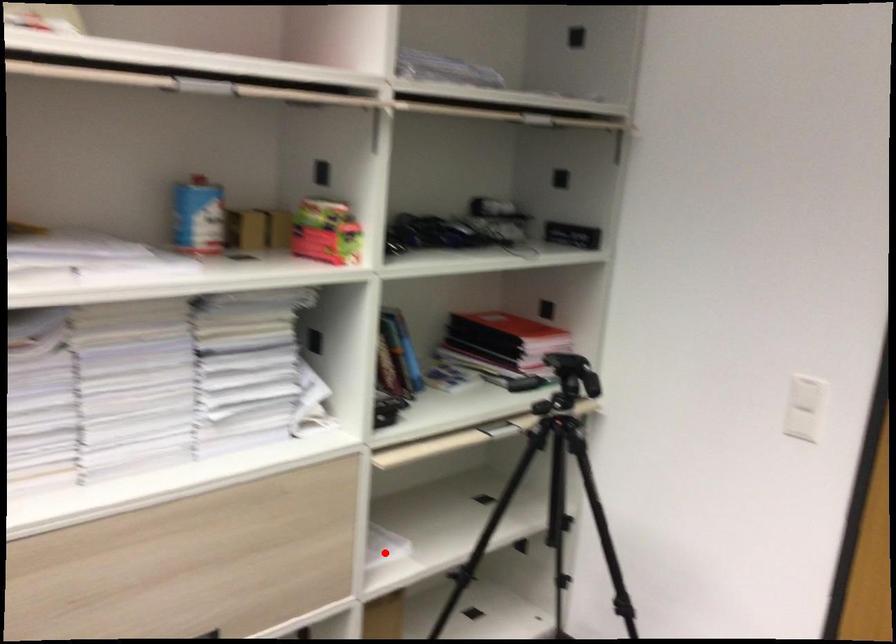
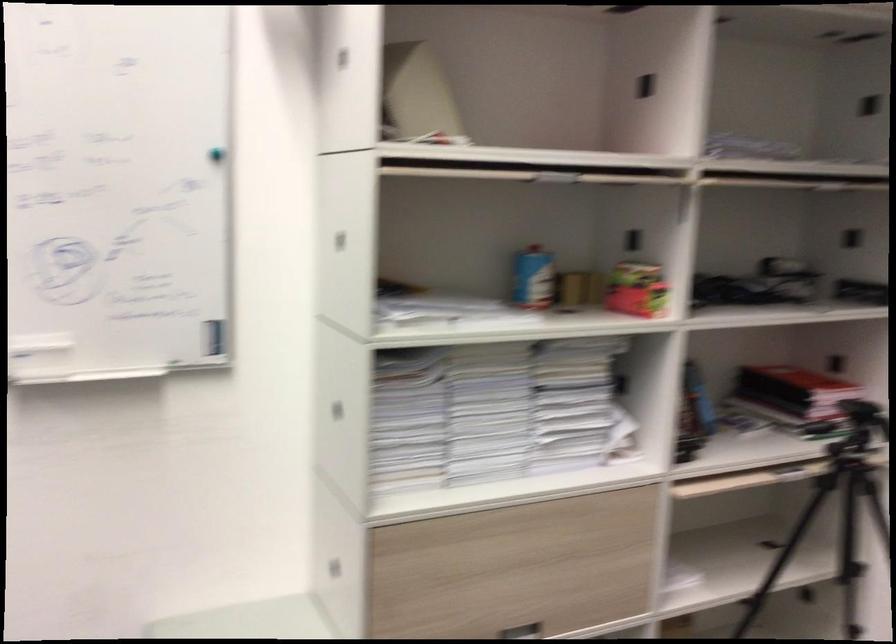
In the second image, find the point that corresponds to the highlighted location in the first image.

(678, 581)